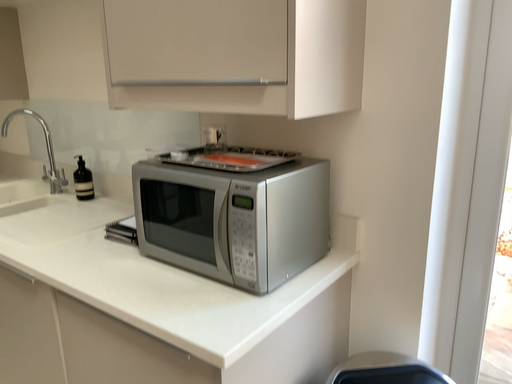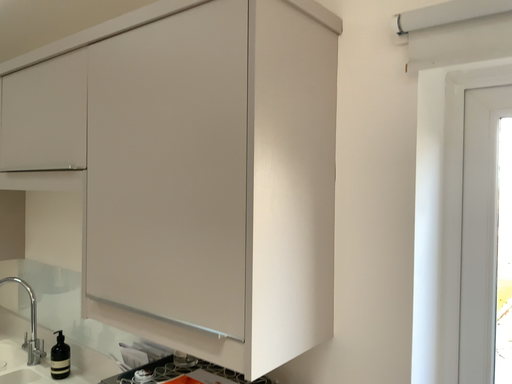
Question: How did the camera likely rotate when shooting the video?

Choices:
 (A) rotated downward
 (B) rotated upward

Answer: (B)